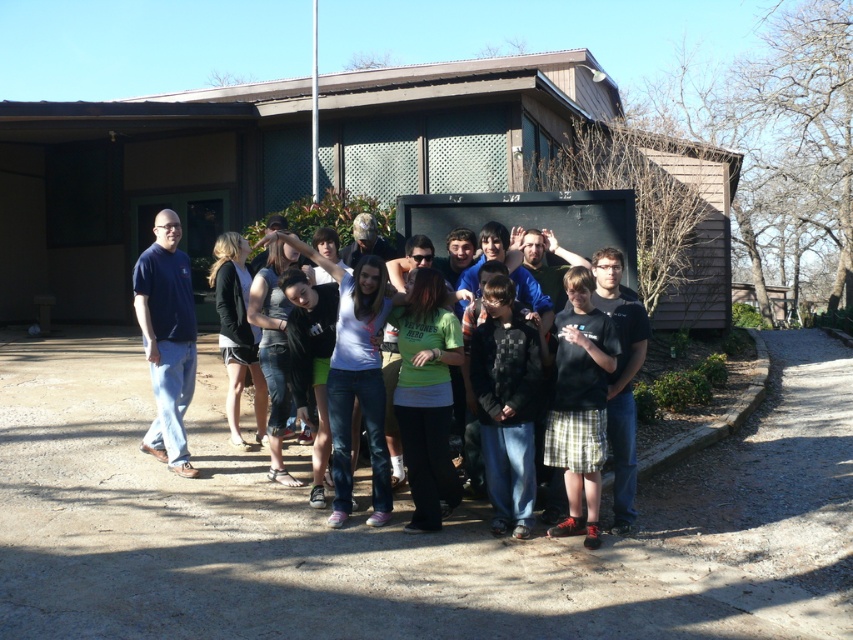
I want to click on dark blue jeans at center, so click(x=506, y=404).

Does point (515, 321) come behind point (585, 292)?

Yes, it is.

Identify the location of dark blue jeans at center. (506, 404).

Who is taller, black cotton shirt at center or metallic flag pole at upper center?

metallic flag pole at upper center is taller.

Is point (560, 436) farther from camera compared to point (317, 84)?

No, it is not.

What are the coordinates of `black cotton shirt at center` in the screenshot? It's located at (579, 403).

Is point (529, 477) in front of point (315, 61)?

Yes, point (529, 477) is in front of point (315, 61).

Is dark blue jeans at center wider than metallic flag pole at upper center?

In fact, dark blue jeans at center might be narrower than metallic flag pole at upper center.

Image resolution: width=853 pixels, height=640 pixels. What do you see at coordinates (506, 404) in the screenshot?
I see `dark blue jeans at center` at bounding box center [506, 404].

Image resolution: width=853 pixels, height=640 pixels. I want to click on dark blue jeans at center, so click(506, 404).